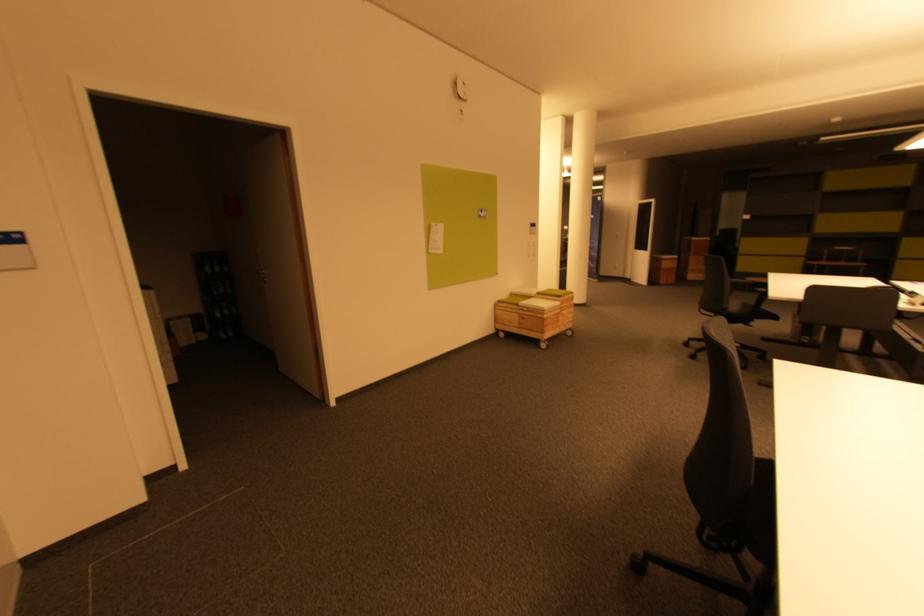
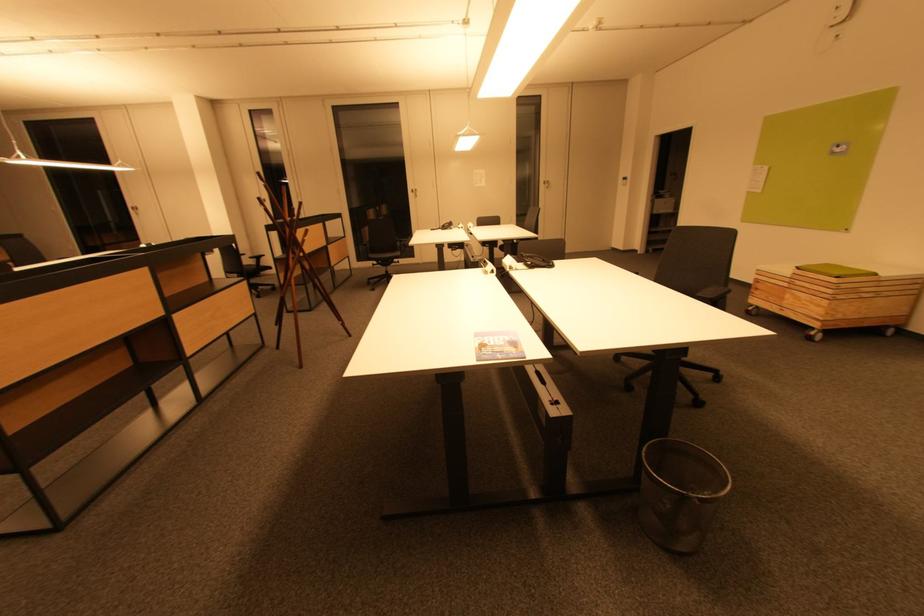
Find the pixel in the second image that matches (x=573, y=315) in the first image.

(816, 305)